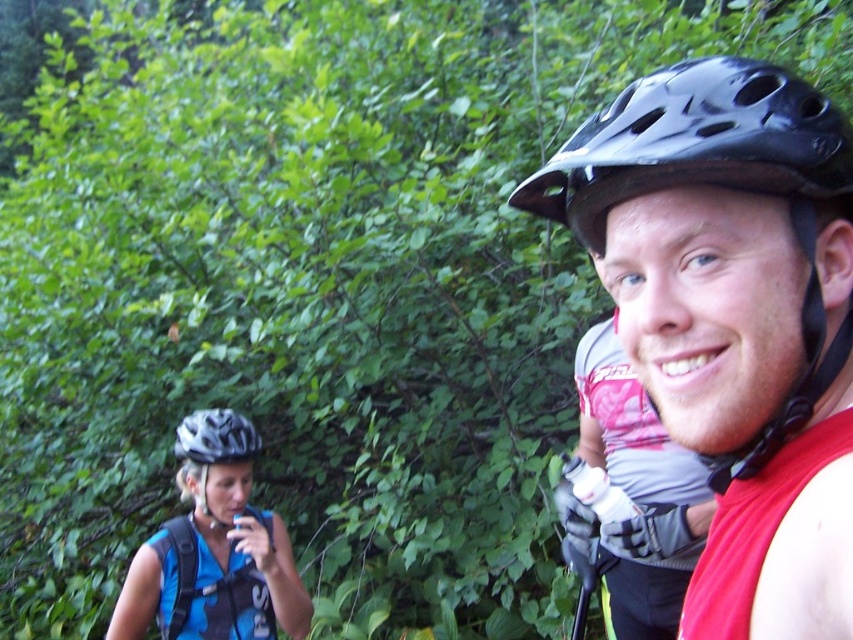
Question: Is blue matte helmet at left to the right of matte black helmet at left from the viewer's perspective?

Choices:
 (A) no
 (B) yes

Answer: (A)

Question: Which object is closer to the camera taking this photo?

Choices:
 (A) matte black helmet at left
 (B) white matte bicycle helmet at left
 (C) blue matte helmet at left

Answer: (C)

Question: Which point is farther to the camera?

Choices:
 (A) matte black helmet at left
 (B) blue matte helmet at left
 (C) black matte helmet at center
 (D) black glossy bicycle helmet at upper right

Answer: (A)

Question: Is black matte helmet at center further to the viewer compared to blue matte helmet at left?

Choices:
 (A) yes
 (B) no

Answer: (B)

Question: Which of the following is the closest to the observer?

Choices:
 (A) matte black helmet at left
 (B) black matte helmet at center
 (C) white matte bicycle helmet at left

Answer: (B)

Question: In this image, where is blue matte helmet at left located relative to matte black helmet at left?

Choices:
 (A) below
 (B) above

Answer: (A)